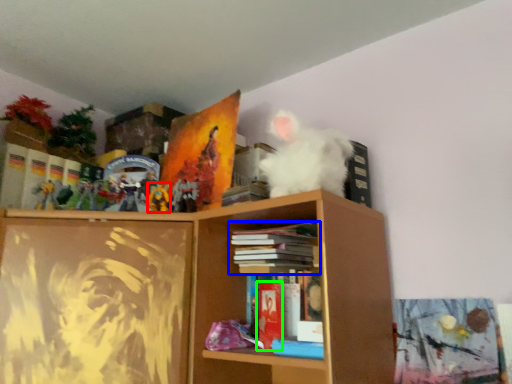
Question: Which is farther away from toy (highlighted by a red box)? book (highlighted by a blue box) or paperback book (highlighted by a green box)?

Choices:
 (A) book
 (B) paperback book

Answer: (B)